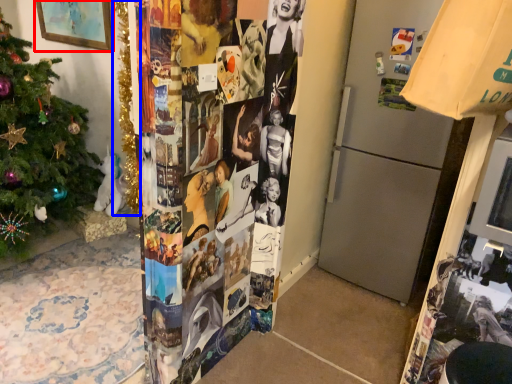
Question: Which object appears closest to the camera in this image, picture frame (highlighted by a red box) or christmas tree (highlighted by a blue box)?

Choices:
 (A) picture frame
 (B) christmas tree

Answer: (B)